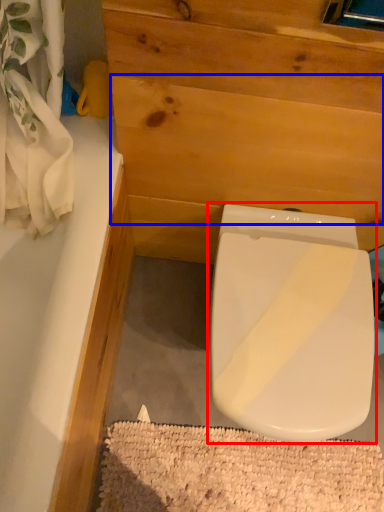
Question: Which of the following is the farthest to the observer, toilet (highlighted by a red box) or plywood (highlighted by a blue box)?

Choices:
 (A) toilet
 (B) plywood

Answer: (A)